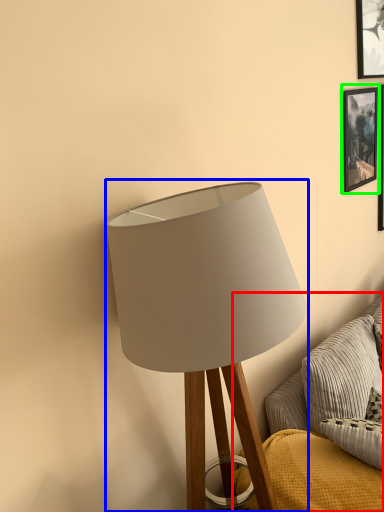
Question: Considering the real-world distances, which object is closest to couch (highlighted by a red box)? lamp (highlighted by a blue box) or picture frame (highlighted by a green box).

Choices:
 (A) lamp
 (B) picture frame

Answer: (A)